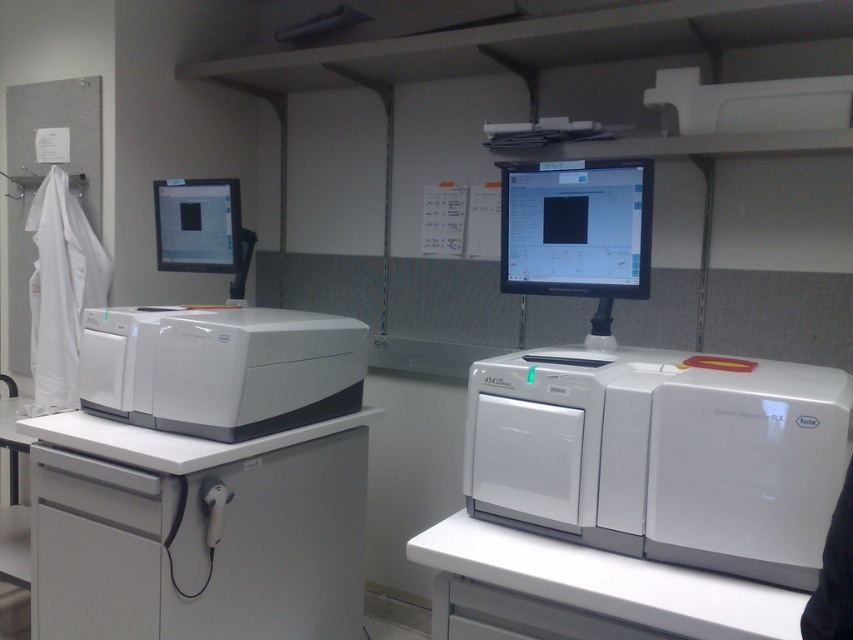
Can you confirm if white plastic equipment at left is positioned to the left of white plastic printer at left?

Incorrect, white plastic equipment at left is not on the left side of white plastic printer at left.

Can you confirm if white plastic equipment at left is smaller than white plastic printer at left?

No.

What do you see at coordinates (196, 531) in the screenshot?
I see `white plastic equipment at left` at bounding box center [196, 531].

The image size is (853, 640). Identify the location of white plastic equipment at left. (196, 531).

Is the position of white plastic printer at right more distant than that of matte black monitor at center?

That is False.

Which of these two, white plastic printer at right or matte black monitor at center, stands taller?

Standing taller between the two is white plastic printer at right.

Where is `white plastic printer at right`? The image size is (853, 640). white plastic printer at right is located at coordinates coord(662,456).

Is point (334, 344) positioned after point (608, 220)?

Yes, point (334, 344) is farther from viewer.

Is white plastic printer at left below matte black monitor at center?

Yes, white plastic printer at left is below matte black monitor at center.

Who is more forward, (224, 371) or (624, 296)?

Point (624, 296)

In order to click on white plastic printer at left in this screenshot , I will do `click(219, 369)`.